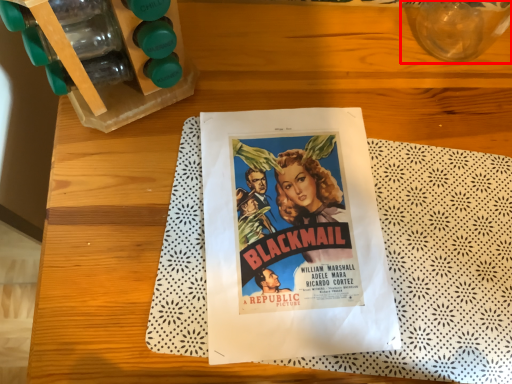
Question: Observing the image, what is the correct spatial positioning of glass vase (annotated by the red box) in reference to paperback book?

Choices:
 (A) right
 (B) left

Answer: (A)